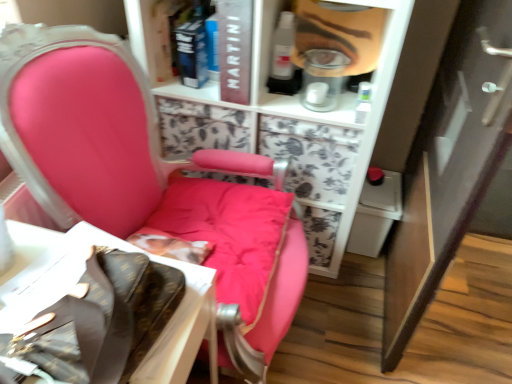
Question: From a real-world perspective, does matte plastic face at upper center stand above white cardboard box at lower left?

Choices:
 (A) no
 (B) yes

Answer: (B)

Question: Is the position of matte plastic face at upper center less distant than that of white cardboard box at lower left?

Choices:
 (A) no
 (B) yes

Answer: (A)

Question: Does matte plastic face at upper center have a greater width compared to white cardboard box at lower left?

Choices:
 (A) yes
 (B) no

Answer: (B)

Question: Is matte plastic face at upper center to the left of white cardboard box at lower left from the viewer's perspective?

Choices:
 (A) no
 (B) yes

Answer: (A)

Question: Is matte plastic face at upper center positioned far away from white cardboard box at lower left?

Choices:
 (A) yes
 (B) no

Answer: (B)

Question: Based on their sizes in the image, would you say matte white cabinet at right is bigger or smaller than matte black book at upper center, which appears as the 1th book when viewed from the right?

Choices:
 (A) big
 (B) small

Answer: (A)

Question: Is matte white cabinet at right wider or thinner than matte black book at upper center, which appears as the 1th book when viewed from the right?

Choices:
 (A) thin
 (B) wide

Answer: (B)

Question: Is point (504, 122) closer or farther from the camera than point (226, 0)?

Choices:
 (A) farther
 (B) closer

Answer: (B)

Question: From a real-world perspective, relative to matte black book at upper center, which is the second book in left-to-right order, is matte white cabinet at right vertically above or below?

Choices:
 (A) above
 (B) below

Answer: (B)

Question: Is matte pink chair at center inside or outside of matte white cabinet at right?

Choices:
 (A) outside
 (B) inside

Answer: (A)

Question: From a real-world perspective, is matte pink chair at center above or below matte white cabinet at right?

Choices:
 (A) below
 (B) above

Answer: (A)

Question: Considering the positions of point (77, 29) and point (385, 357), is point (77, 29) closer or farther from the camera than point (385, 357)?

Choices:
 (A) closer
 (B) farther

Answer: (A)

Question: Is matte pink chair at center to the left or to the right of matte white cabinet at right in the image?

Choices:
 (A) left
 (B) right

Answer: (A)

Question: Considering their positions, is matte white cabinet at right located in front of or behind hardcover book at upper center, the 2th book viewed from the right?

Choices:
 (A) front
 (B) behind

Answer: (A)

Question: Based on their positions, is matte white cabinet at right located to the left or right of hardcover book at upper center, the 2th book viewed from the right?

Choices:
 (A) right
 (B) left

Answer: (A)